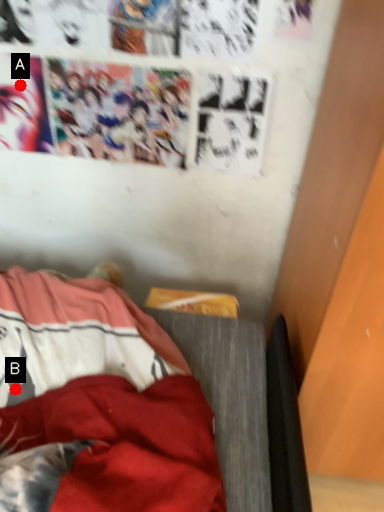
Question: Two points are circled on the image, labeled by A and B beside each circle. Which of the following is the farthest from the observer?

Choices:
 (A) A is further
 (B) B is further

Answer: (A)